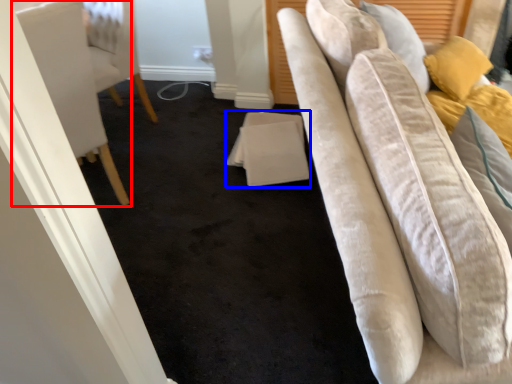
Question: Which object appears closest to the camera in this image, furniture (highlighted by a red box) or table (highlighted by a blue box)?

Choices:
 (A) furniture
 (B) table

Answer: (A)